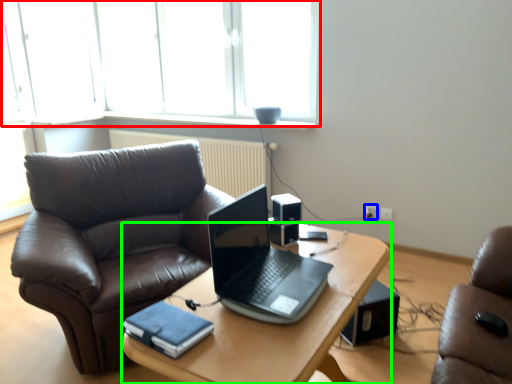
Question: Which object is positioned farthest from window (highlighted by a red box)? Select from power outlet (highlighted by a blue box) and desk (highlighted by a green box).

Choices:
 (A) power outlet
 (B) desk

Answer: (B)